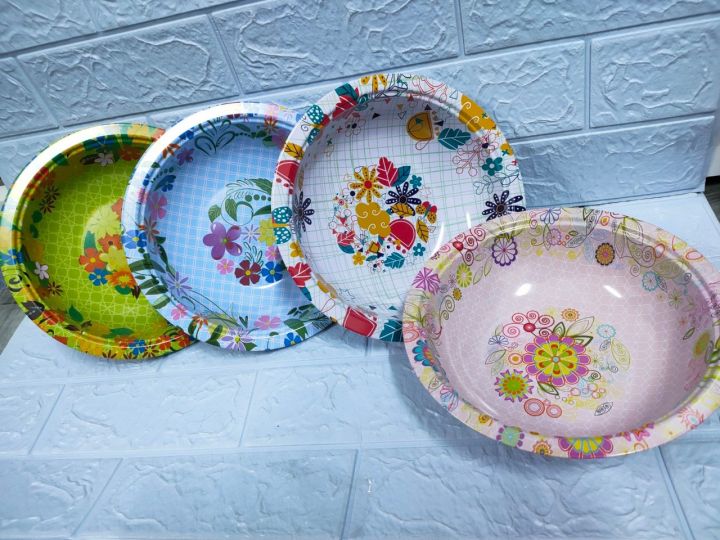
The width and height of the screenshot is (720, 540). I want to click on bowls, so click(510, 313), click(405, 220), click(256, 227), click(114, 239).